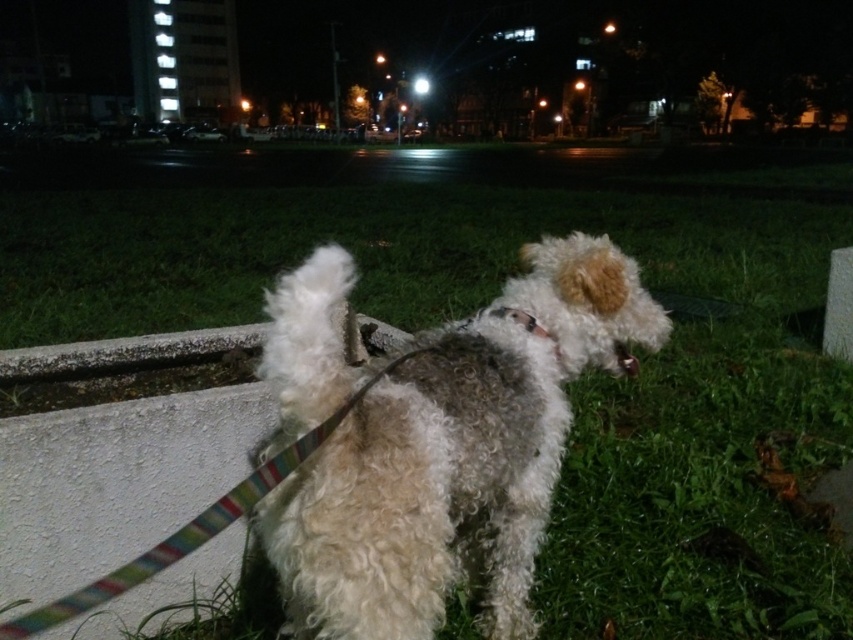
You are a dog owner who wants to ensure the curly fur dog at center is comfortable. Given that the white fabric neckband at center is part of its collar, can you determine if the neckband is loose enough based on their sizes?

The curly fur dog at center is bigger than the white fabric neckband at center, which suggests that the neckband is loose enough since the dog is larger in size compared to the neckband.

You are a dog trainer observing the curly fur dog at center and the white fabric neckband at center. Which object is taller?

The curly fur dog at center is much taller than the white fabric neckband at center.